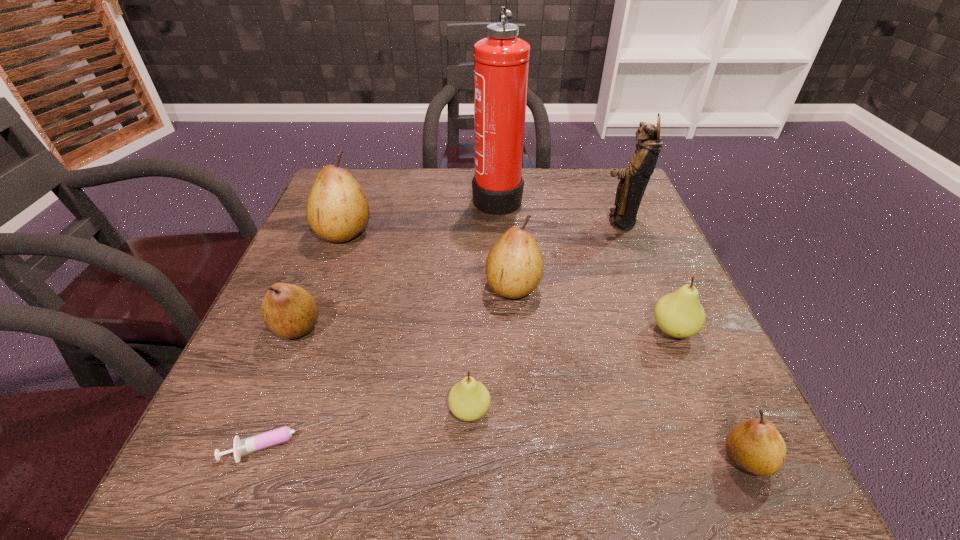
You are a GUI agent. You are given a task and a screenshot of the screen. Output one action in this format:
    pyautogui.click(x=<x>, y=<y>)
    Task: Click on the red fire extinguisher
    This screenshot has height=540, width=960.
    Given the screenshot: What is the action you would take?
    pyautogui.click(x=501, y=61)

What are the coordinates of `fire extinguisher` in the screenshot? It's located at (501, 61).

You are a GUI agent. You are given a task and a screenshot of the screen. Output one action in this format:
    pyautogui.click(x=<x>, y=<y>)
    Task: Click on the figurine
    Image resolution: width=960 pixels, height=540 pixels.
    Given the screenshot: What is the action you would take?
    pyautogui.click(x=634, y=179)

This screenshot has width=960, height=540. Identify the location of the tallest pear. (337, 210).

Locate an element on the screen. This screenshot has height=540, width=960. the biggest brown pear is located at coordinates (337, 210).

Find the location of a particular element. This screenshot has width=960, height=540. the fifth nearest pear is located at coordinates (514, 266).

This screenshot has width=960, height=540. Find the location of `the sixth nearest object`. the sixth nearest object is located at coordinates (x=514, y=266).

Locate an element on the screen. The width and height of the screenshot is (960, 540). the third biggest brown pear is located at coordinates (289, 311).

This screenshot has width=960, height=540. In order to click on the bigger green pear in this screenshot , I will do `click(680, 315)`.

At what (x,y) coordinates should I click in order to perform the action: click on the right green pear. Please return your answer as a coordinate pair (x, y). Looking at the image, I should click on (680, 315).